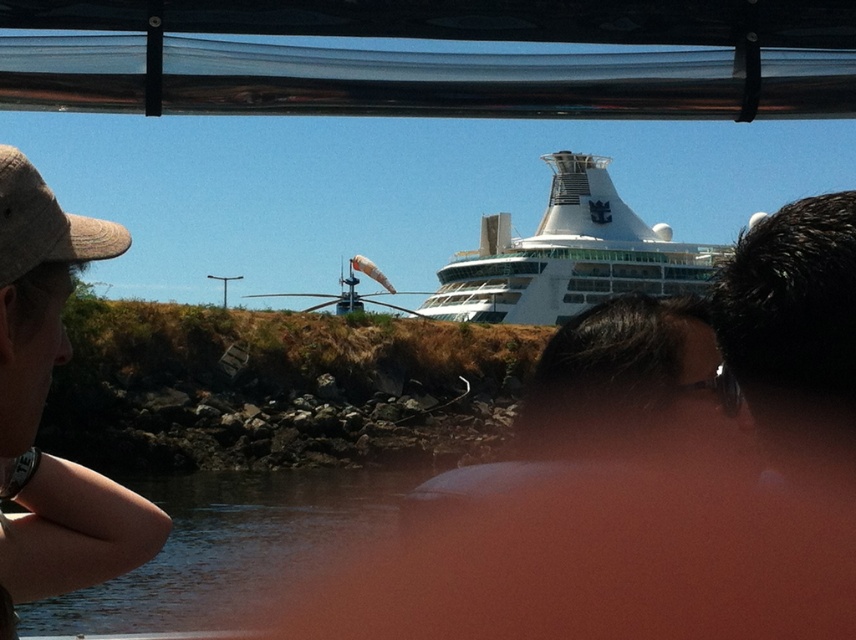
You are a GUI agent. You are given a task and a screenshot of the screen. Output one action in this format:
    pyautogui.click(x=<x>, y=<y>)
    Task: Click on the clear water at lower center
    
    Given the screenshot: What is the action you would take?
    pyautogui.click(x=229, y=548)

Which is below, clear water at lower center or white glossy cruise ship at center?

clear water at lower center is lower down.

What are the coordinates of `clear water at lower center` in the screenshot? It's located at (229, 548).

This screenshot has height=640, width=856. What do you see at coordinates (43, 406) in the screenshot?
I see `brown fabric cap at left` at bounding box center [43, 406].

Which is more to the left, brown fabric cap at left or clear water at lower center?

clear water at lower center

Which is in front, point (16, 312) or point (218, 513)?

Positioned in front is point (16, 312).

Image resolution: width=856 pixels, height=640 pixels. In order to click on brown fabric cap at left in this screenshot , I will do `click(43, 406)`.

Is brown fabric cap at left thinner than white glossy cruise ship at center?

Indeed, brown fabric cap at left has a lesser width compared to white glossy cruise ship at center.

Between point (128, 524) and point (623, 236), which one is positioned behind?

Positioned behind is point (623, 236).

Measure the distance between brown fabric cap at left and camera.

brown fabric cap at left and camera are 41.80 meters apart.

Where is `brown fabric cap at left`? brown fabric cap at left is located at coordinates (43, 406).